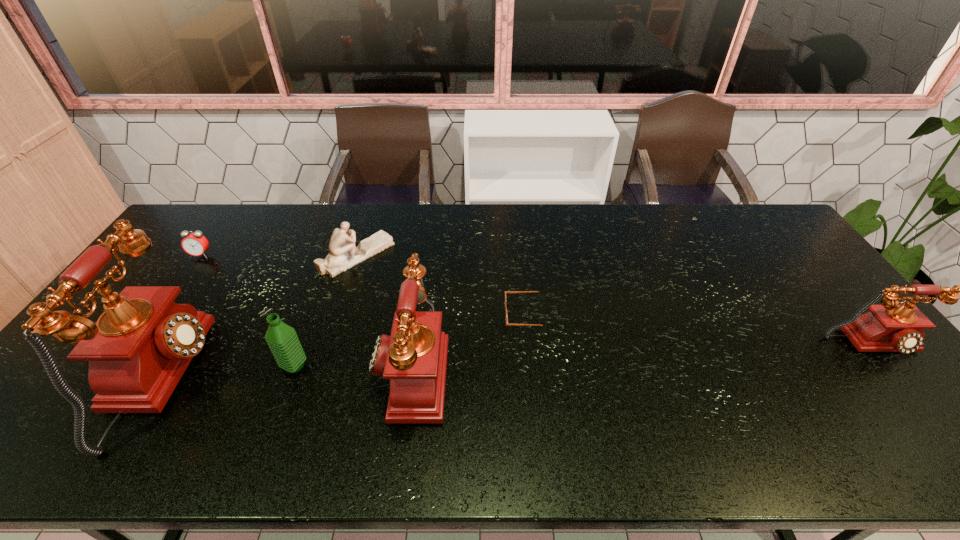
In order to click on free space that is in between the second tallest object and the second shortest object in this screenshot , I will do `click(306, 312)`.

You are a GUI agent. You are given a task and a screenshot of the screen. Output one action in this format:
    pyautogui.click(x=<x>, y=<y>)
    Task: Click on the vacant area that lies between the leftmost telephone and the rightmost telephone
    This screenshot has width=960, height=540.
    Given the screenshot: What is the action you would take?
    pyautogui.click(x=518, y=362)

Find the location of a particular element. blank region between the water bottle and the second shortest object is located at coordinates (248, 310).

Identify the location of empty location between the leftmost telephone and the sunglasses. (347, 347).

Image resolution: width=960 pixels, height=540 pixels. Find the location of `blank region between the third shortest object and the water bottle`. blank region between the third shortest object and the water bottle is located at coordinates (325, 310).

I want to click on free point between the leftmost telephone and the second telephone from right to left, so click(x=289, y=374).

Find the location of `blank region between the second telephone from right to left and the leftmost telephone`. blank region between the second telephone from right to left and the leftmost telephone is located at coordinates (289, 374).

Find the location of a particular element. Image resolution: width=960 pixels, height=540 pixels. free area in between the third shortest object and the shortest object is located at coordinates (443, 285).

Identify the location of empty location between the leftmost telephone and the sunglasses. coord(347,347).

Identify which object is the third nearest to the water bottle. Please provide its 2D coordinates. Your answer should be formatted as a tuple, i.e. [(x, y)], where the tuple contains the x and y coordinates of a point satisfying the conditions above.

[(343, 255)]